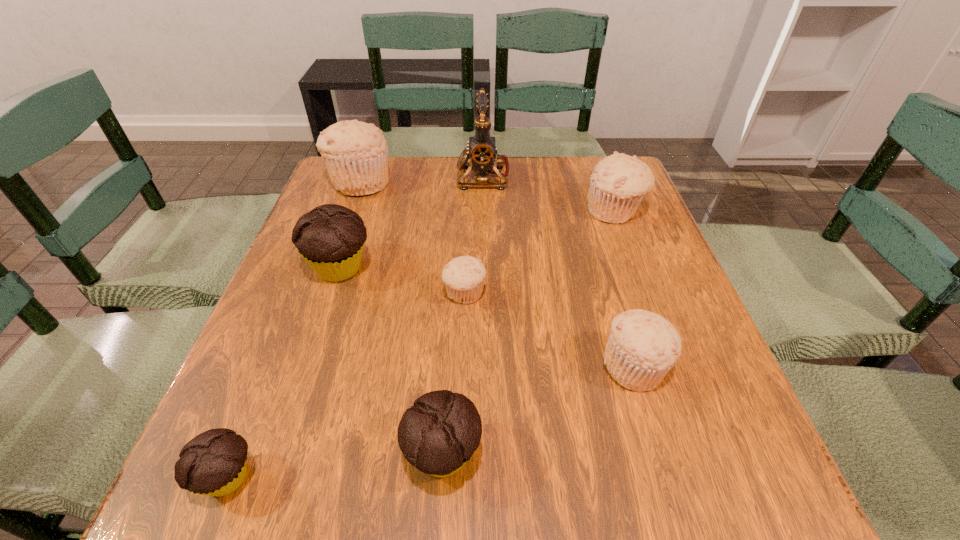
Where is `vacant space located on the back of the third farthest beige muffin`? The height and width of the screenshot is (540, 960). vacant space located on the back of the third farthest beige muffin is located at coordinates (468, 210).

The image size is (960, 540). Identify the location of vacant position located 0.290m on the right of the smallest chocolate muffin. (458, 477).

I want to click on telephone that is at the far edge, so click(x=482, y=152).

This screenshot has height=540, width=960. I want to click on object located at the far left corner, so click(356, 154).

Identify the location of object situated at the near left corner. Image resolution: width=960 pixels, height=540 pixels. (213, 463).

At what (x,y) coordinates should I click in order to perform the action: click on object located in the far right corner section of the desktop. Please return your answer as a coordinate pair (x, y). Looking at the image, I should click on (619, 182).

Image resolution: width=960 pixels, height=540 pixels. Identify the location of vacant space at the far edge of the desktop. (449, 190).

Locate an element on the screen. The image size is (960, 540). free space at the near edge is located at coordinates (477, 500).

In the image, there is a desktop. What are the coordinates of `vacant region at the left edge` in the screenshot? It's located at (290, 261).

Image resolution: width=960 pixels, height=540 pixels. In the image, there is a desktop. In order to click on vacant space at the right edge in this screenshot , I will do `click(667, 403)`.